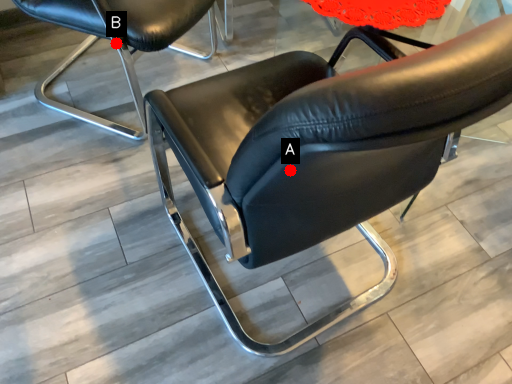
Question: Two points are circled on the image, labeled by A and B beside each circle. Which point is further to the camera?

Choices:
 (A) A is further
 (B) B is further

Answer: (B)